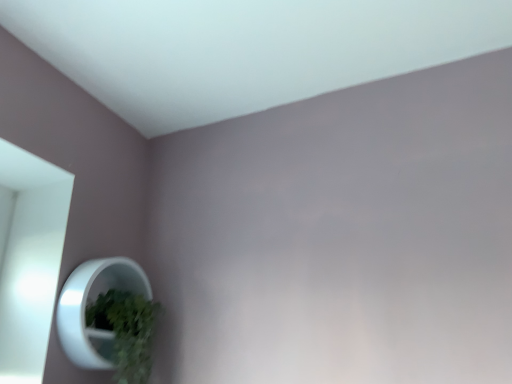
You are a GUI agent. You are given a task and a screenshot of the screen. Output one action in this format:
    pyautogui.click(x=<x>, y=<y>)
    Task: Click on the green matte plant at lower left
    This screenshot has width=512, height=384.
    Given the screenshot: What is the action you would take?
    pyautogui.click(x=126, y=331)

The height and width of the screenshot is (384, 512). Describe the element at coordinates (126, 331) in the screenshot. I see `green matte plant at lower left` at that location.

The width and height of the screenshot is (512, 384). What are the coordinates of `white glossy mirror at lower left` in the screenshot? It's located at (85, 308).

This screenshot has height=384, width=512. What do you see at coordinates (85, 308) in the screenshot?
I see `white glossy mirror at lower left` at bounding box center [85, 308].

The height and width of the screenshot is (384, 512). I want to click on green matte plant at lower left, so click(x=126, y=331).

Consider the image. Considering the positions of objects white glossy mirror at lower left and green matte plant at lower left in the image provided, who is more to the left, white glossy mirror at lower left or green matte plant at lower left?

From the viewer's perspective, white glossy mirror at lower left appears more on the left side.

Is white glossy mirror at lower left positioned in front of green matte plant at lower left?

Yes, the depth of white glossy mirror at lower left is less than that of green matte plant at lower left.

Is point (61, 335) closer to camera compared to point (109, 327)?

That is True.

From the image's perspective, between white glossy mirror at lower left and green matte plant at lower left, which one is located above?

white glossy mirror at lower left is shown above in the image.

From a real-world perspective, is white glossy mirror at lower left physically located above or below green matte plant at lower left?

white glossy mirror at lower left is above green matte plant at lower left.

Looking at this image, is white glossy mirror at lower left thinner than green matte plant at lower left?

Indeed, white glossy mirror at lower left has a lesser width compared to green matte plant at lower left.

Does white glossy mirror at lower left have a lesser height compared to green matte plant at lower left?

No, white glossy mirror at lower left is not shorter than green matte plant at lower left.

Who is smaller, white glossy mirror at lower left or green matte plant at lower left?

green matte plant at lower left is smaller.

Would you say white glossy mirror at lower left contains green matte plant at lower left?

That's correct, green matte plant at lower left is inside white glossy mirror at lower left.

Is white glossy mirror at lower left beside green matte plant at lower left?

Yes, white glossy mirror at lower left is in contact with green matte plant at lower left.

Is green matte plant at lower left at the back of white glossy mirror at lower left?

Yes.

You are a GUI agent. You are given a task and a screenshot of the screen. Output one action in this format:
    pyautogui.click(x=<x>, y=<y>)
    Task: Click on the houseplant below the white glossy mirror at lower left (from a real-world perspective)
    This screenshot has height=384, width=512.
    Given the screenshot: What is the action you would take?
    pyautogui.click(x=126, y=331)

Considering the relative positions of green matte plant at lower left and white glossy mirror at lower left in the image provided, is green matte plant at lower left to the left or to the right of white glossy mirror at lower left?

green matte plant at lower left is to the right of white glossy mirror at lower left.

Does green matte plant at lower left come in front of white glossy mirror at lower left?

No, green matte plant at lower left is further to the viewer.

Does point (153, 302) come farther from viewer compared to point (64, 289)?

Yes, it is.

From the image's perspective, does green matte plant at lower left appear lower than white glossy mirror at lower left?

Yes.

From a real-world perspective, who is located higher, green matte plant at lower left or white glossy mirror at lower left?

white glossy mirror at lower left.

Looking at this image, which object is wider, green matte plant at lower left or white glossy mirror at lower left?

green matte plant at lower left.

Who is taller, green matte plant at lower left or white glossy mirror at lower left?

white glossy mirror at lower left is taller.

Considering the relative sizes of green matte plant at lower left and white glossy mirror at lower left in the image provided, is green matte plant at lower left bigger than white glossy mirror at lower left?

No, green matte plant at lower left is not bigger than white glossy mirror at lower left.

Would you say green matte plant at lower left is inside or outside white glossy mirror at lower left?

green matte plant at lower left is located inside white glossy mirror at lower left.

Does green matte plant at lower left touch white glossy mirror at lower left?

Yes, green matte plant at lower left and white glossy mirror at lower left clearly make contact.

Is green matte plant at lower left facing away from white glossy mirror at lower left?

That's right, green matte plant at lower left is facing away from white glossy mirror at lower left.

Locate an element on the screen. houseplant behind the white glossy mirror at lower left is located at coordinates (126, 331).

Identify the location of mirror above the green matte plant at lower left (from a real-world perspective). This screenshot has height=384, width=512. (85, 308).

The width and height of the screenshot is (512, 384). I want to click on houseplant that is on the right side of white glossy mirror at lower left, so click(126, 331).